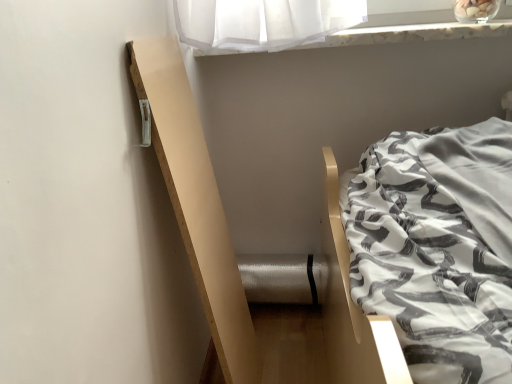
In order to face white marble window sill at upper center, should I rotate leftwards or rightwards?

A 14.234 degree turn to the right will do.

Where is `white marble window sill at upper center`? Image resolution: width=512 pixels, height=384 pixels. white marble window sill at upper center is located at coordinates (412, 33).

This screenshot has width=512, height=384. What do you see at coordinates (412, 33) in the screenshot? I see `white marble window sill at upper center` at bounding box center [412, 33].

You are a GUI agent. You are given a task and a screenshot of the screen. Output one action in this format:
    pyautogui.click(x=<x>, y=<y>)
    Task: Click on the natural wood balustrade at left
    The image size is (512, 384).
    Given the screenshot: What is the action you would take?
    pyautogui.click(x=196, y=202)

In order to face natural wood balustrade at left, should I rotate leftwards or rightwards?

Turn left by 7.820 degrees to look at natural wood balustrade at left.

What do you see at coordinates (196, 202) in the screenshot? Image resolution: width=512 pixels, height=384 pixels. I see `natural wood balustrade at left` at bounding box center [196, 202].

At what (x,y) coordinates should I click in order to perform the action: click on white marble window sill at upper center. Please return your answer as a coordinate pair (x, y). The height and width of the screenshot is (384, 512). Looking at the image, I should click on (412, 33).

Considering the relative positions of natural wood balustrade at left and white marble window sill at upper center in the image provided, is natural wood balustrade at left to the left of white marble window sill at upper center from the viewer's perspective?

Yes.

Is the depth of natural wood balustrade at left less than that of white marble window sill at upper center?

Yes.

Which is nearer, (230, 293) or (386, 40)?

Clearly, point (230, 293) is closer to the camera than point (386, 40).

Consider the image. From the image's perspective, which is below, natural wood balustrade at left or white marble window sill at upper center?

natural wood balustrade at left appears lower in the image.

From a real-world perspective, is natural wood balustrade at left over white marble window sill at upper center?

Incorrect, from a real-world perspective, natural wood balustrade at left is lower than white marble window sill at upper center.

Which of these two, natural wood balustrade at left or white marble window sill at upper center, is thinner?

natural wood balustrade at left is thinner.

Considering the relative sizes of natural wood balustrade at left and white marble window sill at upper center in the image provided, is natural wood balustrade at left taller than white marble window sill at upper center?

Indeed, natural wood balustrade at left has a greater height compared to white marble window sill at upper center.

Based on their sizes in the image, would you say natural wood balustrade at left is bigger or smaller than white marble window sill at upper center?

In the image, natural wood balustrade at left appears to be smaller than white marble window sill at upper center.

Is natural wood balustrade at left inside or outside of white marble window sill at upper center?

natural wood balustrade at left cannot be found inside white marble window sill at upper center.

Are natural wood balustrade at left and white marble window sill at upper center located far from each other?

That's not correct — natural wood balustrade at left is a little close to white marble window sill at upper center.

Is natural wood balustrade at left facing away from white marble window sill at upper center?

No, natural wood balustrade at left's orientation is not away from white marble window sill at upper center.

Looking at this image, what's the angular difference between natural wood balustrade at left and white marble window sill at upper center's facing directions?

The angular difference between natural wood balustrade at left and white marble window sill at upper center is 90.1 degrees.

Consider the image. Measure the distance from natural wood balustrade at left to white marble window sill at upper center.

natural wood balustrade at left is 19.54 inches from white marble window sill at upper center.

The width and height of the screenshot is (512, 384). Identify the location of balustrade that appears below the white marble window sill at upper center (from the image's perspective). (196, 202).

Would you say white marble window sill at upper center is to the left or to the right of natural wood balustrade at left in the picture?

Based on their positions, white marble window sill at upper center is located to the right of natural wood balustrade at left.

Is white marble window sill at upper center positioned before natural wood balustrade at left?

No, white marble window sill at upper center is further to the viewer.

Is point (341, 40) behind point (199, 263)?

Yes.

From the image's perspective, between white marble window sill at upper center and natural wood balustrade at left, which one is located above?

white marble window sill at upper center, from the image's perspective.

From a real-world perspective, who is located lower, white marble window sill at upper center or natural wood balustrade at left?

natural wood balustrade at left.

Considering the sizes of objects white marble window sill at upper center and natural wood balustrade at left in the image provided, who is wider, white marble window sill at upper center or natural wood balustrade at left?

A: white marble window sill at upper center.

Between white marble window sill at upper center and natural wood balustrade at left, which one has less height?

Standing shorter between the two is white marble window sill at upper center.

Between white marble window sill at upper center and natural wood balustrade at left, which one has smaller size?

With smaller size is natural wood balustrade at left.

Can we say white marble window sill at upper center lies outside natural wood balustrade at left?

Absolutely, white marble window sill at upper center is external to natural wood balustrade at left.

Is white marble window sill at upper center touching natural wood balustrade at left?

white marble window sill at upper center is not next to natural wood balustrade at left, and they're not touching.

Is white marble window sill at upper center facing towards natural wood balustrade at left?

No, white marble window sill at upper center is not oriented towards natural wood balustrade at left.

How many degrees apart are the facing directions of white marble window sill at upper center and natural wood balustrade at left?

The angular difference between white marble window sill at upper center and natural wood balustrade at left is 90.1 degrees.

At what (x,y) coordinates should I click in order to perform the action: click on window sill on the right of natural wood balustrade at left. Please return your answer as a coordinate pair (x, y). The height and width of the screenshot is (384, 512). Looking at the image, I should click on (412, 33).

This screenshot has width=512, height=384. Identify the location of balustrade on the left of white marble window sill at upper center. (196, 202).

I want to click on window sill that is behind the natural wood balustrade at left, so click(x=412, y=33).